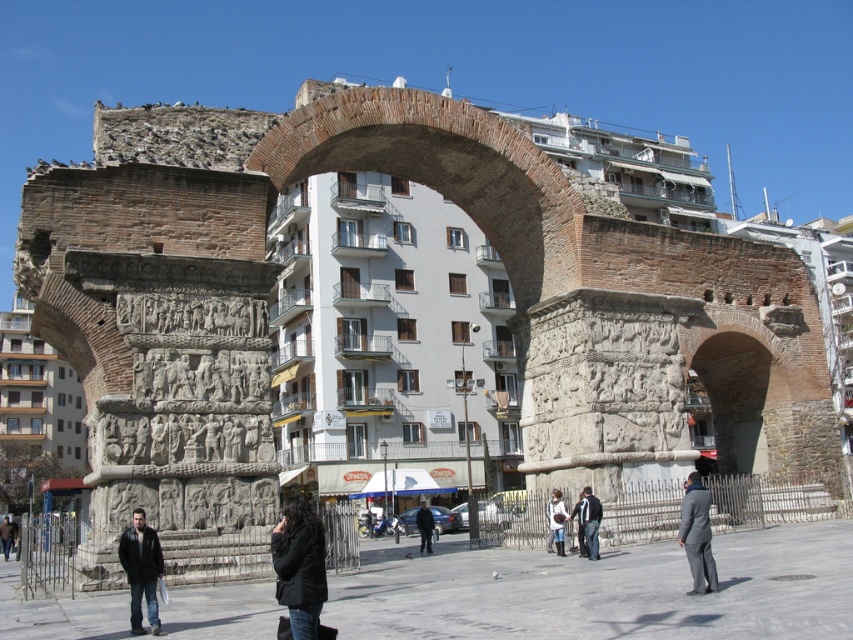
Can you confirm if dark gray suit at center is positioned below dark gray jacket at lower center?

Actually, dark gray suit at center is above dark gray jacket at lower center.

Does dark gray suit at center have a smaller size compared to dark gray jacket at lower center?

Incorrect, dark gray suit at center is not smaller in size than dark gray jacket at lower center.

Between point (695, 540) and point (567, 516), which one is positioned behind?

The point (567, 516) is behind.

Identify the location of dark gray suit at center. This screenshot has width=853, height=640. (697, 534).

Does dark gray jacket at lower left have a larger size compared to dark brown leather jacket at lower left?

No, dark gray jacket at lower left is not bigger than dark brown leather jacket at lower left.

Who is more forward, (137, 554) or (9, 520)?

Point (137, 554) is in front.

Between point (155, 611) and point (4, 536), which one is positioned behind?

The point (4, 536) is behind.

Locate an element on the screen. This screenshot has width=853, height=640. dark gray jacket at lower left is located at coordinates (141, 570).

Which is more to the left, black leather jacket at lower center or dark blue jacket at center?

Positioned to the left is black leather jacket at lower center.

Can you confirm if black leather jacket at lower center is taller than dark blue jacket at center?

No.

Does point (318, 552) come farther from viewer compared to point (432, 529)?

No, it is not.

Image resolution: width=853 pixels, height=640 pixels. Find the location of `black leather jacket at lower center`. black leather jacket at lower center is located at coordinates tap(299, 566).